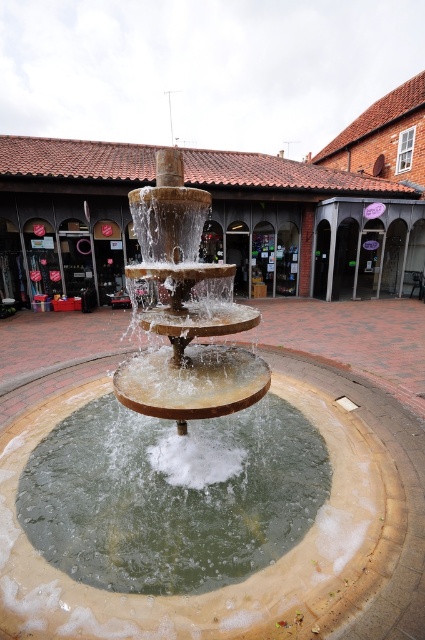
Question: Which object is farther from the camera taking this photo?

Choices:
 (A) green stone water at center
 (B) brown stone fountain at center

Answer: (B)

Question: Which object appears farthest from the camera in this image?

Choices:
 (A) green stone water at center
 (B) brown stone fountain at center

Answer: (B)

Question: Which of the following is the closest to the observer?

Choices:
 (A) brown stone fountain at center
 (B) green stone water at center

Answer: (B)

Question: From the image, what is the correct spatial relationship of brown stone fountain at center in relation to green stone water at center?

Choices:
 (A) right
 (B) left

Answer: (A)

Question: Considering the relative positions of brown stone fountain at center and green stone water at center in the image provided, where is brown stone fountain at center located with respect to green stone water at center?

Choices:
 (A) right
 (B) left

Answer: (A)

Question: Is brown stone fountain at center thinner than green stone water at center?

Choices:
 (A) yes
 (B) no

Answer: (B)